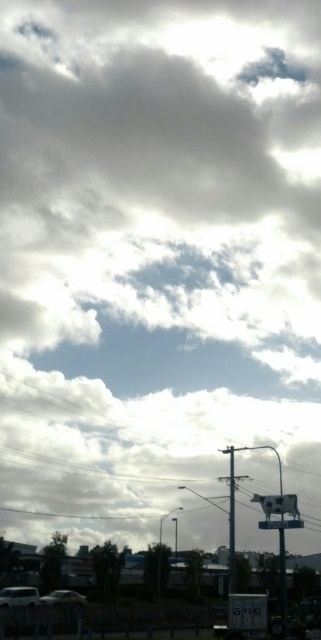
You are a pedestrian standing on the sidewalk and see the silver metallic car at lower left and the white plastic sign at center. Which object is closer to the left side of your view?

The silver metallic car at lower left is positioned on the left side of white plastic sign at center, so it is closer to the left side of your view.

You are a drone operator trying to deliver a package to the top of the metallic pole at center. The coordinates given for the pole are point (232, 524). Can you confirm if the pole is located in the lower part of the image?

The metallic pole at center is represented by point (232, 524). Since the coordinate system typically starts from the bottom left corner, a y value of 0.723 places it in the lower part of the image.

In the scene shown: You are a drone operator trying to navigate between two points in the sky. You see a point at coordinates point (234,572) and another at point (81,596). Which point is closer to the camera?

Point (234,572) is in front of point (81,596), so it is closer to the camera.